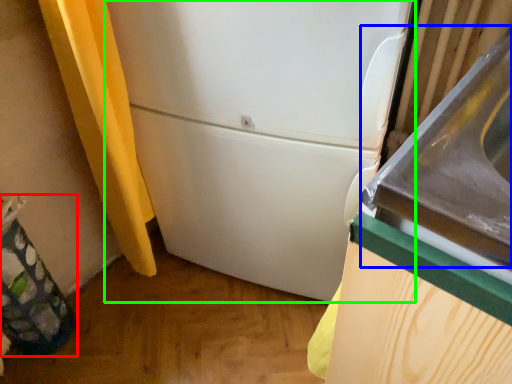
Question: Which is nearer to the garbage (highlighted by a red box)? sink (highlighted by a blue box) or refrigerator (highlighted by a green box).

Choices:
 (A) sink
 (B) refrigerator

Answer: (B)